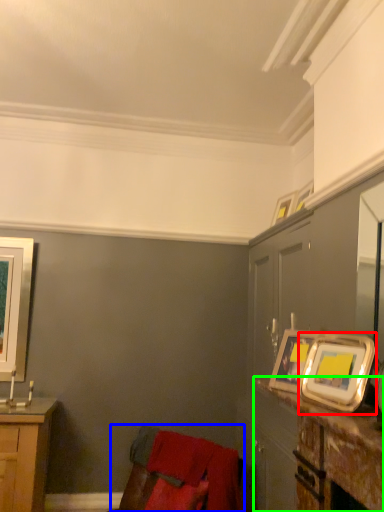
Question: Based on their relative distances, which object is farther from picture frame (highlighted by a red box)? Choose from swivel chair (highlighted by a blue box) and table (highlighted by a green box).

Choices:
 (A) swivel chair
 (B) table

Answer: (A)